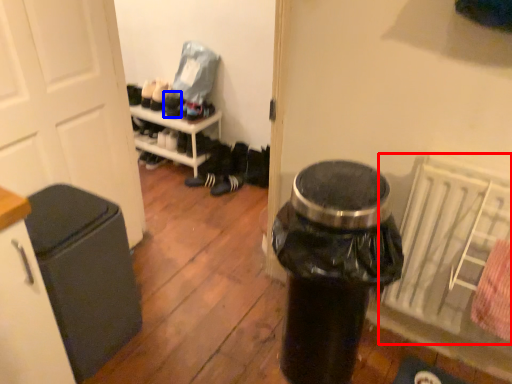
Question: Among these objects, which one is nearest to the camera, radiator (highlighted by a red box) or shoe (highlighted by a blue box)?

Choices:
 (A) radiator
 (B) shoe

Answer: (A)